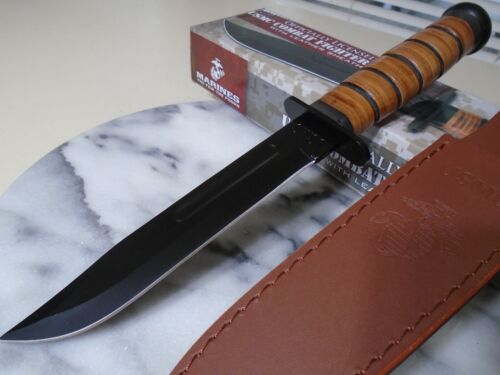
Where is `tan counter top`? This screenshot has height=375, width=500. tan counter top is located at coordinates (135, 84), (469, 72).